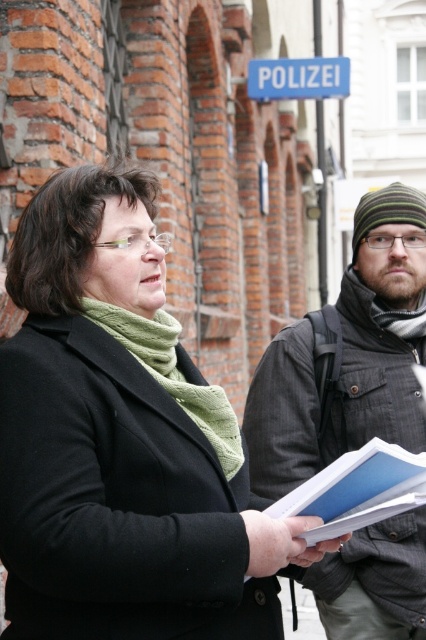
Question: Is dark gray textured jacket at center to the right of green knitted scarf at left from the viewer's perspective?

Choices:
 (A) no
 (B) yes

Answer: (B)

Question: Which point is closer to the camera?

Choices:
 (A) (356, 508)
 (B) (132, 228)
 (C) (379, 328)

Answer: (A)

Question: Is blue paper at center bigger than green knitted scarf at left?

Choices:
 (A) no
 (B) yes

Answer: (A)

Question: Does dark gray textured jacket at center lie in front of blue plastic sign at upper center?

Choices:
 (A) yes
 (B) no

Answer: (A)

Question: Which of the following is the closest to the observer?

Choices:
 (A) black matte coat at center
 (B) green knitted scarf at left
 (C) blue plastic sign at upper center

Answer: (A)

Question: Estimate the real-world distances between objects in this image. Which object is farther from the blue paper at center?

Choices:
 (A) dark gray textured jacket at center
 (B) green knitted scarf at left
 (C) black matte coat at center
 (D) blue plastic sign at upper center

Answer: (D)